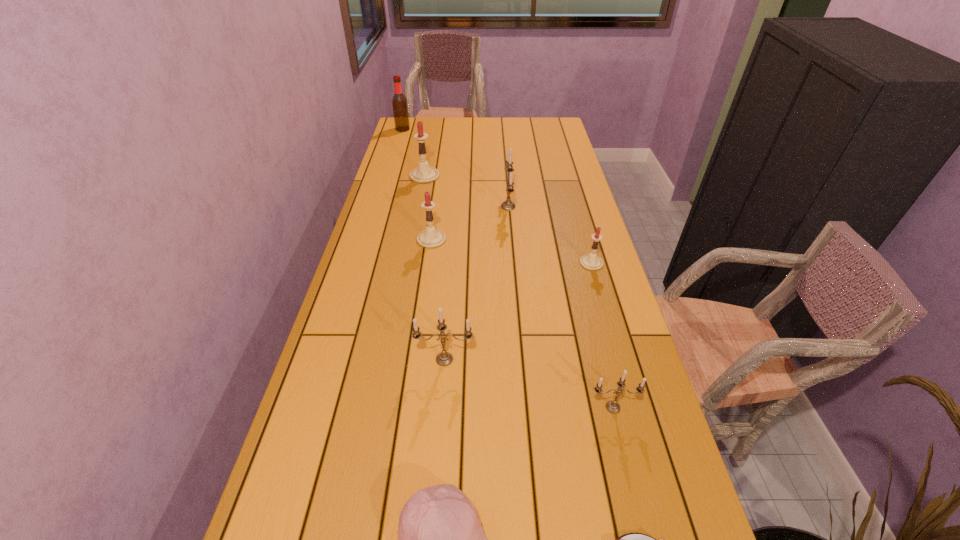
Where is `free space between the second metallic candle from left to right and the third nearest object`? free space between the second metallic candle from left to right and the third nearest object is located at coordinates (561, 307).

Locate an element on the screen. Image resolution: width=960 pixels, height=540 pixels. free space between the sixth nearest object and the nearest candle is located at coordinates (522, 323).

At what (x,y) coordinates should I click in order to perform the action: click on free point between the third nearest object and the farthest object. Please return your answer as a coordinate pair (x, y). Image resolution: width=960 pixels, height=540 pixels. Looking at the image, I should click on (508, 268).

At what (x,y) coordinates should I click in order to perform the action: click on free spot between the second nearest red candle and the fourth nearest object. Please return your answer as a coordinate pair (x, y). Looking at the image, I should click on (438, 299).

Find the location of a particular element. The height and width of the screenshot is (540, 960). the fourth closest object to the sandwich is located at coordinates (591, 261).

Select which object is the seventh closest to the sandwich. Please provide its 2D coordinates. Your answer should be formatted as a tuple, i.e. [(x, y)], where the tuple contains the x and y coordinates of a point satisfying the conditions above.

[(423, 174)]

Locate an element on the screen. The height and width of the screenshot is (540, 960). candle that can be found as the second closest to the farthest red candle is located at coordinates (430, 238).

Identify the location of candle that is the fifth closest to the second farthest candle. This screenshot has width=960, height=540. (613, 407).

Image resolution: width=960 pixels, height=540 pixels. In order to click on the closest metallic candle to the sixth nearest object in this screenshot , I will do `click(508, 204)`.

You are a GUI agent. You are given a task and a screenshot of the screen. Output one action in this format:
    pyautogui.click(x=<x>, y=<y>)
    Task: Click on the metallic candle that is the second closest to the sixth farthest object
    The height and width of the screenshot is (540, 960).
    Given the screenshot: What is the action you would take?
    pyautogui.click(x=508, y=204)